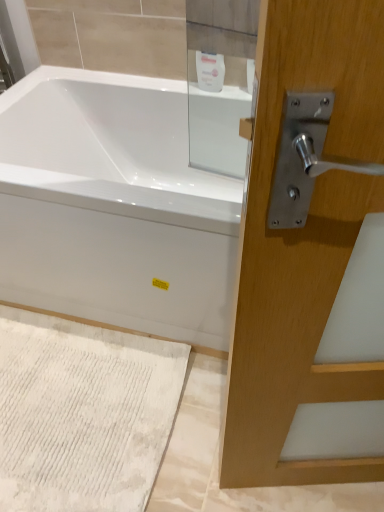
Identify the location of free spot to the left of white glossy soap dispenser at upper center. This screenshot has height=512, width=384. (169, 86).